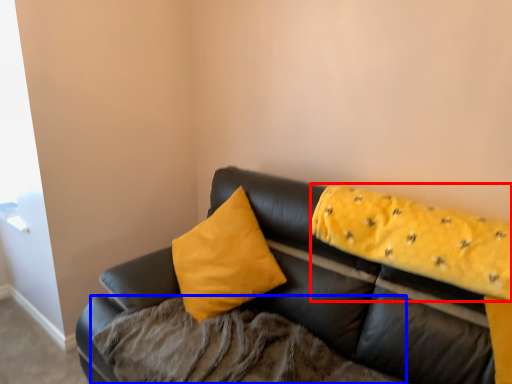
Question: Which object appears farthest to the camera in this image, blanket (highlighted by a red box) or bedding (highlighted by a blue box)?

Choices:
 (A) blanket
 (B) bedding

Answer: (A)